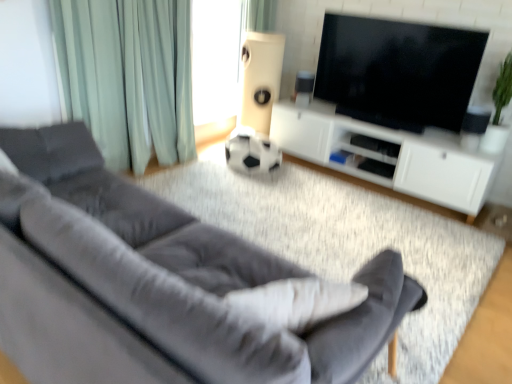
Question: Relative to white matte cabinet at center, is velvet gray couch at lower left in front or behind?

Choices:
 (A) behind
 (B) front

Answer: (B)

Question: From the image's perspective, is velvet gray couch at lower left located above or below white matte cabinet at center?

Choices:
 (A) below
 (B) above

Answer: (A)

Question: Which object is positioned closest to the velvet gray couch at lower left?

Choices:
 (A) black glossy tv at upper center
 (B) white matte cabinet at center
 (C) green fabric curtain at upper center, which appears as the second curtain when ordered from the bottom
 (D) white plastic speaker at upper center, which is the 2th speaker from left to right
 (E) white matte speaker at center, marked as the second speaker in a right-to-left arrangement

Answer: (B)

Question: Which of these objects is positioned closest to the green fabric curtain at left, the 2th curtain in the back-to-front sequence?

Choices:
 (A) black glossy tv at upper center
 (B) white matte speaker at center, marked as the second speaker in a right-to-left arrangement
 (C) white matte cabinet at center
 (D) velvet gray couch at lower left
 (E) green fabric curtain at upper center, which appears as the second curtain when ordered from the bottom

Answer: (B)